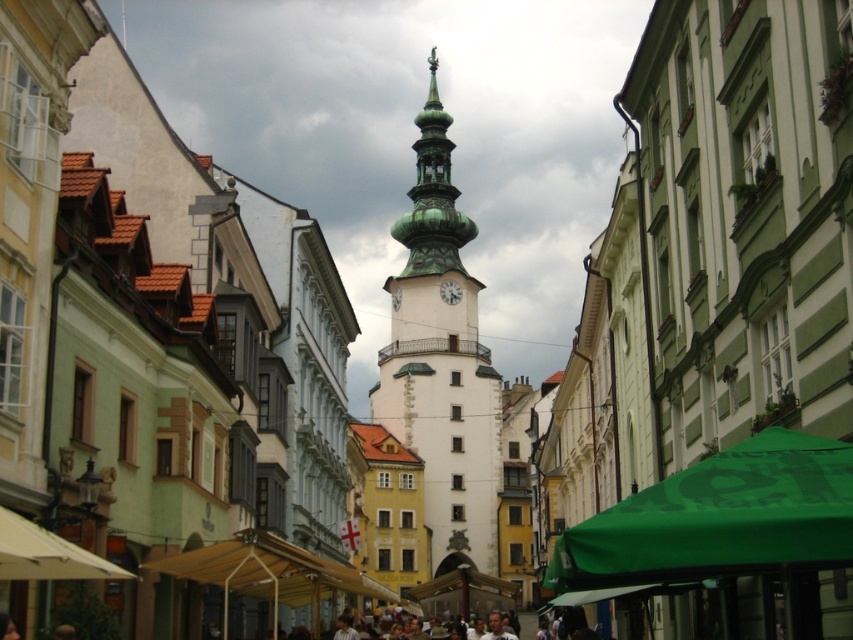
Between green copper clock tower at center and beige fabric canopy at lower left, which one appears on the right side from the viewer's perspective?

Positioned to the right is green copper clock tower at center.

Can you confirm if green copper clock tower at center is shorter than beige fabric canopy at lower left?

No.

Where is `green copper clock tower at center`? The height and width of the screenshot is (640, 853). green copper clock tower at center is located at coordinates (440, 362).

Between green fabric canopy at lower right and white stone clock at center, which one appears on the right side from the viewer's perspective?

green fabric canopy at lower right is more to the right.

Is green fabric canopy at lower right shorter than white stone clock at center?

No, green fabric canopy at lower right is not shorter than white stone clock at center.

Is point (769, 554) positioned before point (445, 291)?

Yes, it is in front of point (445, 291).

I want to click on green fabric canopy at lower right, so [720, 518].

Between yellow fabric canopy at lower center and beige fabric canopy at lower left, which one is positioned lower?

yellow fabric canopy at lower center

Who is taller, yellow fabric canopy at lower center or beige fabric canopy at lower left?

Standing taller between the two is yellow fabric canopy at lower center.

Which is behind, point (259, 582) or point (18, 550)?

The point (259, 582) is more distant.

Image resolution: width=853 pixels, height=640 pixels. Identify the location of yellow fabric canopy at lower center. (268, 573).